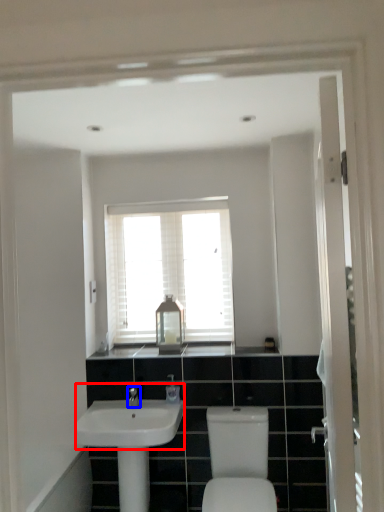
Question: Among these objects, which one is nearest to the camera, sink (highlighted by a red box) or tap (highlighted by a blue box)?

Choices:
 (A) sink
 (B) tap

Answer: (A)